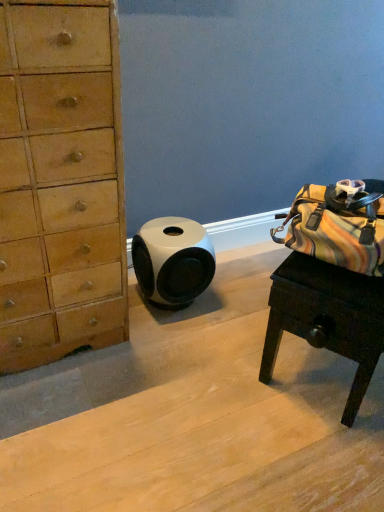
Image resolution: width=384 pixels, height=512 pixels. Identify the location of white glossy speaker at center. (173, 260).

Image resolution: width=384 pixels, height=512 pixels. Describe the element at coordinates (173, 260) in the screenshot. I see `white glossy speaker at center` at that location.

Image resolution: width=384 pixels, height=512 pixels. What do you see at coordinates (327, 318) in the screenshot?
I see `wooden desk at right` at bounding box center [327, 318].

The height and width of the screenshot is (512, 384). In order to click on wooden desk at right in this screenshot , I will do `click(327, 318)`.

In order to click on white glossy speaker at center in this screenshot , I will do `click(173, 260)`.

From the picture: Considering the positions of objects white glossy speaker at center and wooden desk at right in the image provided, who is more to the left, white glossy speaker at center or wooden desk at right?

white glossy speaker at center is more to the left.

Is the depth of white glossy speaker at center less than that of wooden desk at right?

No, the depth of white glossy speaker at center is greater than that of wooden desk at right.

Is point (167, 234) positioned in front of point (373, 351)?

No, it is behind (373, 351).

From the image's perspective, is white glossy speaker at center located above wooden desk at right?

Correct, white glossy speaker at center appears higher than wooden desk at right in the image.

From a real-world perspective, is white glossy speaker at center positioned over wooden desk at right based on gravity?

No, from a real-world perspective, white glossy speaker at center is not on top of wooden desk at right.

Considering the sizes of objects white glossy speaker at center and wooden desk at right in the image provided, who is thinner, white glossy speaker at center or wooden desk at right?

white glossy speaker at center is thinner.

Who is shorter, white glossy speaker at center or wooden desk at right?

white glossy speaker at center.

Which of these two, white glossy speaker at center or wooden desk at right, is smaller?

Smaller between the two is white glossy speaker at center.

In the scene shown: Can wooden desk at right be found inside white glossy speaker at center?

Definitely not — wooden desk at right is not inside white glossy speaker at center.

Is the surface of white glossy speaker at center in direct contact with wooden desk at right?

No, white glossy speaker at center is not beside wooden desk at right.

Does white glossy speaker at center turn towards wooden desk at right?

No, white glossy speaker at center does not turn towards wooden desk at right.

The image size is (384, 512). I want to click on speaker that is above the wooden desk at right (from the image's perspective), so click(173, 260).

Considering the relative positions of wooden desk at right and white glossy speaker at center in the image provided, is wooden desk at right to the left or to the right of white glossy speaker at center?

wooden desk at right is positioned on white glossy speaker at center's right side.

Is wooden desk at right in front of white glossy speaker at center?

Yes, it is in front of white glossy speaker at center.

Is point (347, 327) closer or farther from the camera than point (136, 268)?

Point (347, 327) is closer to the camera than point (136, 268).

From the image's perspective, relative to white glossy speaker at center, is wooden desk at right above or below?

Clearly, from the image's perspective, wooden desk at right is below white glossy speaker at center.

From a real-world perspective, relative to white glossy speaker at center, is wooden desk at right vertically above or below?

Clearly, from a real-world perspective, wooden desk at right is above white glossy speaker at center.

Considering the relative sizes of wooden desk at right and white glossy speaker at center in the image provided, is wooden desk at right wider than white glossy speaker at center?

Yes, wooden desk at right is wider than white glossy speaker at center.

Does wooden desk at right have a greater height compared to white glossy speaker at center?

Yes, wooden desk at right is taller than white glossy speaker at center.

Considering the relative sizes of wooden desk at right and white glossy speaker at center in the image provided, is wooden desk at right smaller than white glossy speaker at center?

No, wooden desk at right is not smaller than white glossy speaker at center.

Would you say white glossy speaker at center is part of wooden desk at right's contents?

No, white glossy speaker at center is not inside wooden desk at right.

Are wooden desk at right and white glossy speaker at center making contact?

No, wooden desk at right is not with white glossy speaker at center.

Is wooden desk at right oriented towards white glossy speaker at center?

No, wooden desk at right is not aimed at white glossy speaker at center.

The image size is (384, 512). Identify the location of desk in front of the white glossy speaker at center. (327, 318).

Image resolution: width=384 pixels, height=512 pixels. What are the coordinates of `desk that appears in front of the white glossy speaker at center` in the screenshot? It's located at (327, 318).

You are a GUI agent. You are given a task and a screenshot of the screen. Output one action in this format:
    pyautogui.click(x=<x>, y=<y>)
    Task: Click on the speaker that appears on the left of wooden desk at right
    
    Given the screenshot: What is the action you would take?
    pyautogui.click(x=173, y=260)